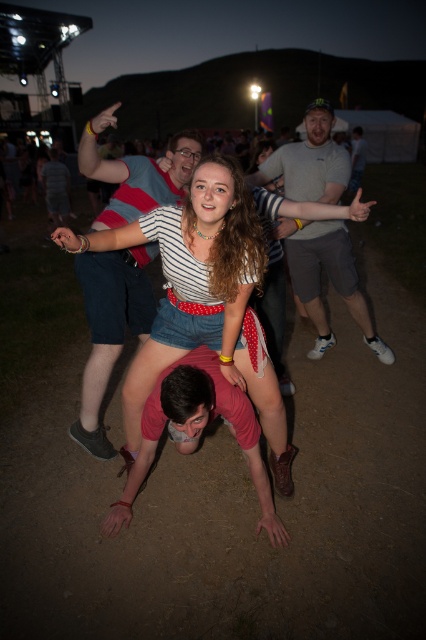
From the picture: You are a photographer trying to capture a group photo of the white striped shirt at center and the gray fabric shirt at center. Your camera has a minimum focus distance of 1.5 meters. Will you be able to focus on both subjects simultaneously?

The white striped shirt at center is 1.20 meters from the gray fabric shirt at center, which is within the camera minimum focus distance of 1.5 meters. Yes, you can focus on both subjects simultaneously.

You are standing at the origin point of the image coordinate system. The striped t shirt at center is located at point (109, 326). If you want to move towards the striped t shirt at center, in which direction should you move?

To move towards the striped t shirt at center located at point (109, 326), you should move in the positive x and positive y direction since the coordinates are greater than the origin point at 0,0.